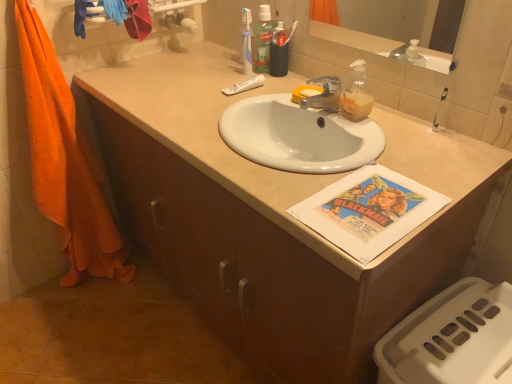
At what (x,y) coordinates should I click in order to perform the action: click on free space in front of orange cotton towel at left. Please return your answer as a coordinate pair (x, y). Looking at the image, I should click on (83, 323).